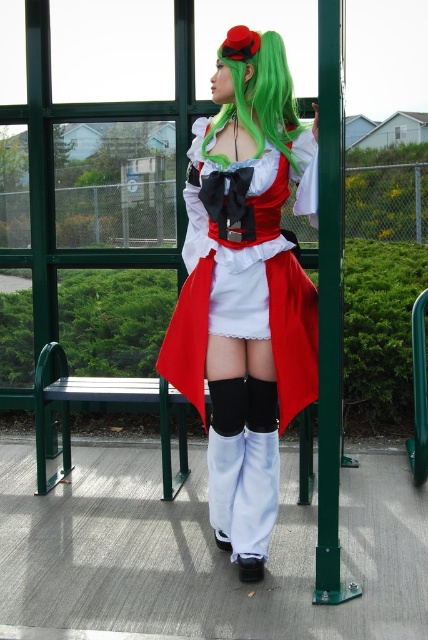
The width and height of the screenshot is (428, 640). In order to click on green metal bench at left in this screenshot , I will do `click(103, 401)`.

Between green metal bench at left and green silky wig at center, which one is positioned lower?

green metal bench at left

Identify the location of green metal bench at left. Image resolution: width=428 pixels, height=640 pixels. point(103,401).

Who is more distant from viewer, (211, 138) or (237, 108)?

Point (211, 138)

Is point (302, 324) positioned in front of point (246, 81)?

That is False.

The width and height of the screenshot is (428, 640). Find the location of `satin red coat at center`. satin red coat at center is located at coordinates (244, 291).

Can you confirm if satin red coat at center is taller than green metal bench at left?

Indeed, satin red coat at center has a greater height compared to green metal bench at left.

Is satin red coat at center further to camera compared to green metal bench at left?

No, it is not.

Who is more distant from viewer, (250,157) or (163,440)?

Point (163,440)

Where is `satin red coat at center`? The width and height of the screenshot is (428, 640). satin red coat at center is located at coordinates point(244,291).